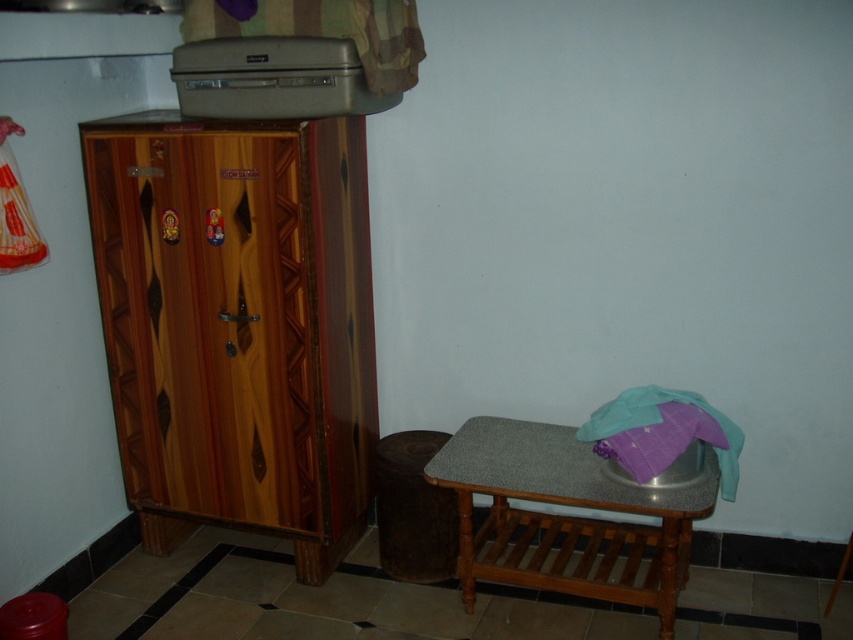
You are trying to decide where to place a tall plant that needs a lot of space. Based on the scene, which object between the wooden wardrobe at left and the granite top wooden table at lower right would be a better choice for placing the plant?

The wooden wardrobe at left is much taller than the granite top wooden table at lower right, so placing the tall plant near the wooden wardrobe at left would provide more vertical space for the plant to grow.

You are organizing your room and want to place a new bookshelf between the wooden wardrobe at left and the granite top wooden table at lower right. Can you determine which side of the bookshelf should face the wall based on their positions?

The wooden wardrobe at left is to the left of the granite top wooden table at lower right, so the bookshelf should be placed with its right side facing the wall to align with the existing furniture arrangement.

You are organizing a room and need to place a large poster on the wall. The poster is too big to fit on the smaller furniture. Which object between the wooden wardrobe at left and the granite top wooden table at lower right should you choose to place the poster on?

The wooden wardrobe at left has a larger size compared to the granite top wooden table at lower right, so you should place the poster on the wooden wardrobe at left.